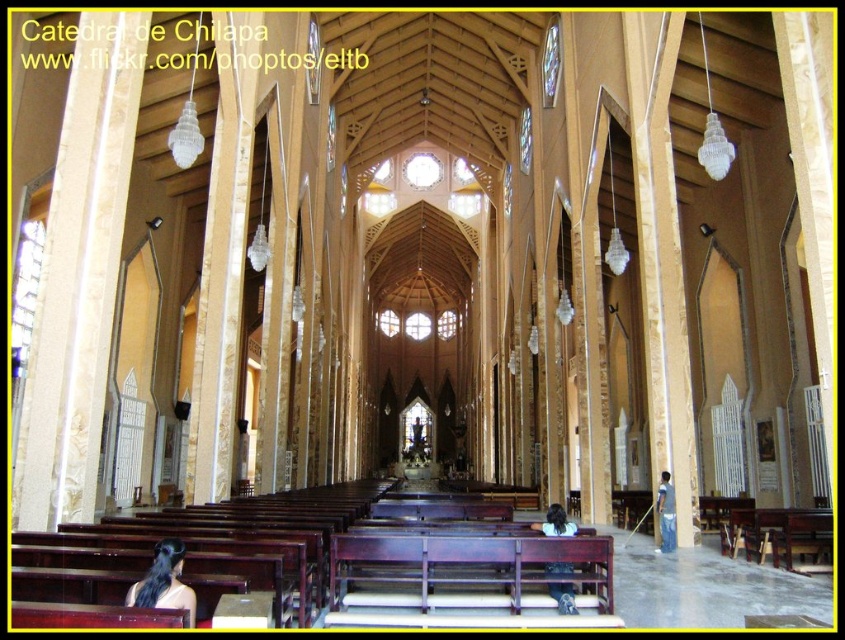
Based on the photo, is black hair at center positioned in front of light brown wooden bench at lower center?

Yes, it is.

Which of these two, black hair at center or light brown wooden bench at lower center, stands taller?

light brown wooden bench at lower center is taller.

Locate an element on the screen. black hair at center is located at coordinates (164, 580).